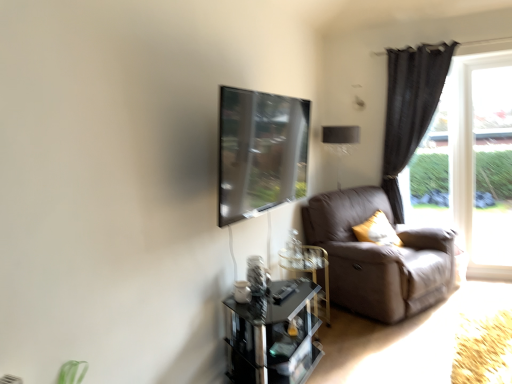
Image resolution: width=512 pixels, height=384 pixels. I want to click on clear glass door at right, so click(x=484, y=163).

The width and height of the screenshot is (512, 384). Describe the element at coordinates (378, 257) in the screenshot. I see `leather at right` at that location.

Measure the distance between point (296, 341) and camera.

The distance of point (296, 341) from camera is 2.45 meters.

At what (x,y) coordinates should I click in order to perform the action: click on transparent glass table at lower center. Please return your answer as a coordinate pair (x, y). The height and width of the screenshot is (384, 512). Looking at the image, I should click on (273, 335).

In order to face clear glass table at lower center, should I rotate leftwards or rightwards?

Rotate right and turn 6.352 degrees.

Find the location of `yellow fabric pillow at right`. yellow fabric pillow at right is located at coordinates (377, 231).

The width and height of the screenshot is (512, 384). What do you see at coordinates (377, 231) in the screenshot? I see `yellow fabric pillow at right` at bounding box center [377, 231].

Identify the location of clear glass door at right. This screenshot has height=384, width=512. pyautogui.click(x=484, y=163).

How different are the orientations of transparent glass table at lower center and clear glass door at right in degrees?

They differ by 89.6 degrees in their facing directions.

Considering the relative sizes of transparent glass table at lower center and clear glass door at right in the image provided, is transparent glass table at lower center smaller than clear glass door at right?

Incorrect, transparent glass table at lower center is not smaller in size than clear glass door at right.

Is transparent glass table at lower center surrounding clear glass door at right?

No, transparent glass table at lower center does not contain clear glass door at right.

Is transparent glass table at lower center positioned with its back to clear glass door at right?

No, transparent glass table at lower center's orientation is not away from clear glass door at right.

Can you confirm if clear glass door at right is taller than clear glass table at lower center?

Yes.

From the image's perspective, between clear glass door at right and clear glass table at lower center, which one is located above?

clear glass door at right, from the image's perspective.

Between clear glass door at right and clear glass table at lower center, which one has larger width?

With larger width is clear glass table at lower center.

In the image, is clear glass door at right positioned in front of or behind clear glass table at lower center?

clear glass door at right is behind clear glass table at lower center.

Based on their positions, is dark gray fabric curtain at right located to the left or right of clear glass door at right?

Based on their positions, dark gray fabric curtain at right is located to the left of clear glass door at right.

From the image's perspective, which is above, dark gray fabric curtain at right or clear glass door at right?

dark gray fabric curtain at right is shown above in the image.

In terms of width, does dark gray fabric curtain at right look wider or thinner when compared to clear glass door at right?

In the image, dark gray fabric curtain at right appears to be wider than clear glass door at right.

This screenshot has width=512, height=384. Find the location of `window frame below the dark gray fabric curtain at right (from the image's perspective)`. window frame below the dark gray fabric curtain at right (from the image's perspective) is located at coordinates (484, 163).

From the picture: Which object is closer to the camera, clear glass door at right or dark gray fabric curtain at right?

Positioned in front is dark gray fabric curtain at right.

Does clear glass door at right have a greater width compared to dark gray fabric curtain at right?

No.

Is point (462, 103) closer or farther from the camera than point (414, 81)?

Point (462, 103).

Is clear glass table at lower center not near transparent glass table at lower center?

No, clear glass table at lower center is not far from transparent glass table at lower center.

In the scene shown: Which point is more forward, (317, 281) or (274, 337)?

The point (274, 337) is closer to the camera.

What's the angular difference between clear glass table at lower center and transparent glass table at lower center's facing directions?

The angular difference between clear glass table at lower center and transparent glass table at lower center is 0.00019 degrees.

Consider the image. Considering the relative sizes of clear glass table at lower center and transparent glass table at lower center in the image provided, is clear glass table at lower center thinner than transparent glass table at lower center?

Yes.

Can you confirm if clear glass table at lower center is smaller than dark gray fabric curtain at right?

Yes.

Is the position of clear glass table at lower center more distant than that of dark gray fabric curtain at right?

No.

Which is in front, point (328, 292) or point (398, 185)?

The point (328, 292) is more forward.

Which of these two, clear glass table at lower center or dark gray fabric curtain at right, stands shorter?

Standing shorter between the two is clear glass table at lower center.

From the image's perspective, is dark gray fabric curtain at right located beneath leather at right?

No, from the image's perspective, dark gray fabric curtain at right is not below leather at right.

Is dark gray fabric curtain at right located outside leather at right?

dark gray fabric curtain at right is positioned outside leather at right.

Is dark gray fabric curtain at right bigger than leather at right?

No, dark gray fabric curtain at right is not bigger than leather at right.

In the scene shown: From a real-world perspective, between dark gray fabric curtain at right and leather at right, who is vertically lower?

In real-world perspective, leather at right is lower.

Locate an element on the screen. table that is in front of the clear glass door at right is located at coordinates (273, 335).

The image size is (512, 384). Identify the location of window frame above the clear glass table at lower center (from a real-world perspective). (484, 163).

When comparing their distances from leather at right, does transparent glass table at lower center or clear glass door at right seem further?

clear glass door at right.

In the scene shown: Looking at the image, which one is located closer to transparent glass window screen at upper center, dark gray fabric curtain at right or clear glass table at lower center?

clear glass table at lower center is positioned closer to the anchor transparent glass window screen at upper center.

Estimate the real-world distances between objects in this image. Which object is closer to transparent glass table at lower center, dark gray fabric curtain at right or clear glass door at right?

dark gray fabric curtain at right lies closer to transparent glass table at lower center than the other object.

Estimate the real-world distances between objects in this image. Which object is further from clear glass table at lower center, transparent glass window at right or transparent glass window screen at upper center?

transparent glass window at right is positioned further to the anchor clear glass table at lower center.

Based on the photo, looking at the image, which one is located further to leather at right, transparent glass window screen at upper center or yellow fabric pillow at right?

Among the two, transparent glass window screen at upper center is located further to leather at right.

When comparing their distances from clear glass table at lower center, does dark gray fabric curtain at right or transparent glass window screen at upper center seem further?

dark gray fabric curtain at right.

Estimate the real-world distances between objects in this image. Which object is closer to clear glass table at lower center, leather at right or transparent glass window screen at upper center?

leather at right is closer to clear glass table at lower center.

Which object lies further to the anchor point dark gray fabric curtain at right, transparent glass window screen at upper center or yellow fabric pillow at right?

Among the two, transparent glass window screen at upper center is located further to dark gray fabric curtain at right.

I want to click on studio couch situated between yellow fabric pillow at right and clear glass door at right from left to right, so click(378, 257).

In order to click on window located between yellow fabric pillow at right and clear glass door at right in the left-right direction in this screenshot , I will do `click(469, 164)`.

Locate an element on the screen. studio couch between clear glass table at lower center and clear glass door at right is located at coordinates (378, 257).

I want to click on curtain situated between yellow fabric pillow at right and transparent glass window at right from left to right, so click(410, 108).